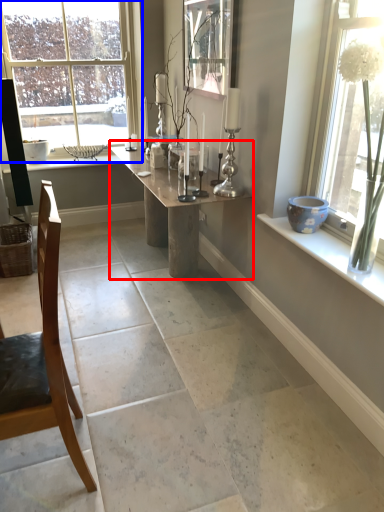
Question: Which point is closer to the camera, table (highlighted by a red box) or window (highlighted by a blue box)?

Choices:
 (A) table
 (B) window

Answer: (A)